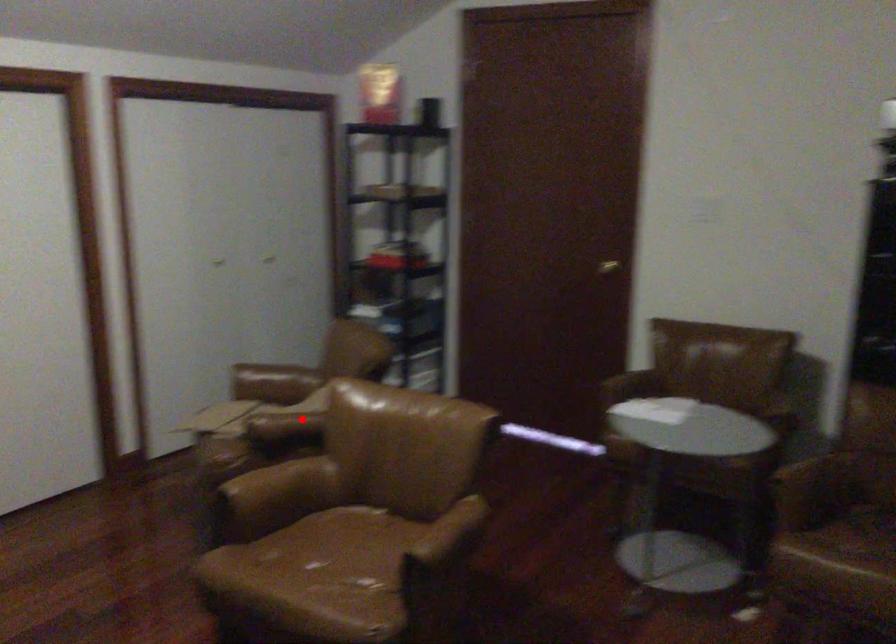
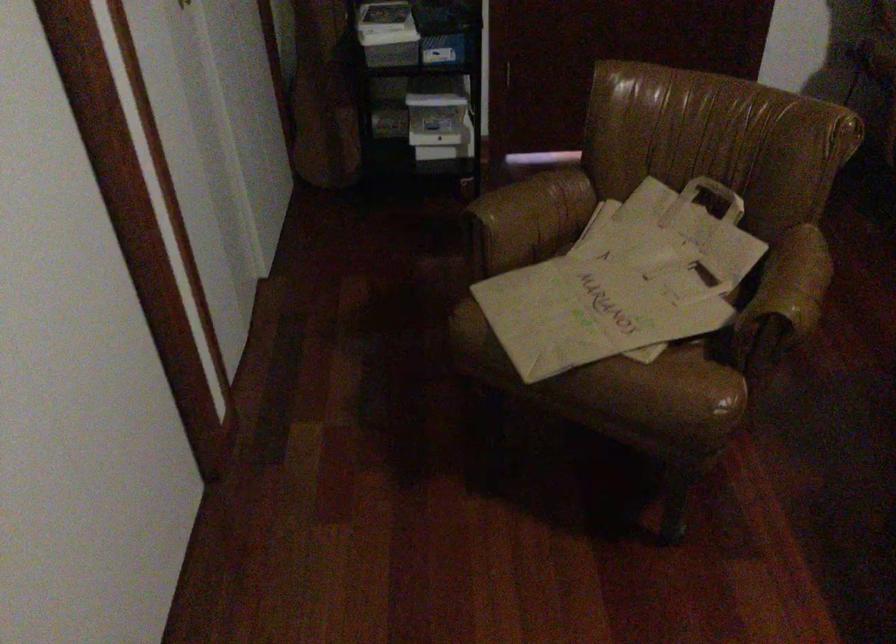
Question: A red point is marked in image1. In image2, is the corresponding 3D point closer to the camera or farther? Reply with the corresponding letter.

Choices:
 (A) The corresponding 3D point is closer.
 (B) The corresponding 3D point is farther.

Answer: (A)